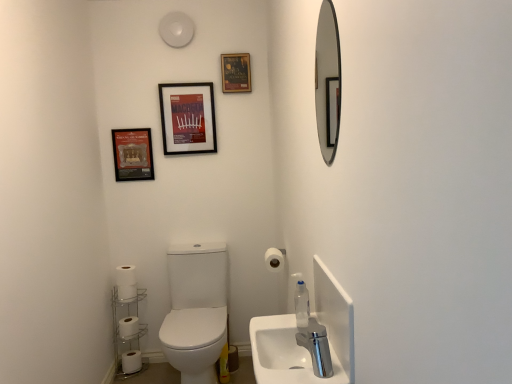
Locate an element on the screen. Image resolution: width=512 pixels, height=384 pixels. white ceramic sink at lower right is located at coordinates (x=285, y=354).

Describe the element at coordinates (188, 118) in the screenshot. I see `matte black picture frame at upper center` at that location.

The image size is (512, 384). What are the coordinates of `matte paper poster at upper center, which appears as the second decorative picture when ordered from the bottom` in the screenshot? It's located at (236, 72).

You are a GUI agent. You are given a task and a screenshot of the screen. Output one action in this format:
    pyautogui.click(x=<x>, y=<y>)
    Task: Click on the white matte toilet paper at lower left, the 3th toilet paper in the right-to-left sequence
    
    Given the screenshot: What is the action you would take?
    pyautogui.click(x=126, y=292)

Measure the distance between silver/metallic toilet paper holder at lower left and camera.

They are 8.21 feet apart.

Where is `white matte toilet paper at lower left, which is the fourth toilet paper in right-to-left order`? white matte toilet paper at lower left, which is the fourth toilet paper in right-to-left order is located at coordinates (128, 327).

From the image's perspective, which toilet paper is the 3rd one above the silver/metallic toilet paper holder at lower left? Please provide its 2D coordinates.

[(274, 260)]

In the scene shown: Considering the relative sizes of silver/metallic toilet paper holder at lower left and white matte toilet paper at lower right, which ranks as the fourth toilet paper in back-to-front order, in the image provided, is silver/metallic toilet paper holder at lower left shorter than white matte toilet paper at lower right, which ranks as the fourth toilet paper in back-to-front order,?

No, silver/metallic toilet paper holder at lower left is not shorter than white matte toilet paper at lower right, which ranks as the fourth toilet paper in back-to-front order.

Does silver/metallic toilet paper holder at lower left have a smaller size compared to white matte toilet paper at lower right, which ranks as the fourth toilet paper in back-to-front order?

No.

Considering their positions, is silver/metallic toilet paper holder at lower left located in front of or behind white matte toilet paper at lower right, which ranks as the fourth toilet paper in back-to-front order?

silver/metallic toilet paper holder at lower left is behind white matte toilet paper at lower right, which ranks as the fourth toilet paper in back-to-front order.

At what (x,y) coordinates should I click in order to perform the action: click on toiletry above the white matte toilet paper at lower left, the third toilet paper from the top (from the image's perspective). Please return your answer as a coordinate pair (x, y). Looking at the image, I should click on (302, 305).

Is clear plastic soap dispenser at lower right looking in the opposite direction of white matte toilet paper at lower left, which is counted as the 1th toilet paper, starting from the left?

No.

Between point (304, 307) and point (131, 333), which one is positioned in front?

Point (304, 307)

How different are the orientations of white matte toilet paper at lower left, placed as the second toilet paper when sorted from bottom to top, and matte black picture frame at upper center in degrees?

They differ by 3.6 degrees in their facing directions.

Is white matte toilet paper at lower left, which is the 2th toilet paper in back-to-front order, positioned in front of matte black picture frame at upper center?

No, the depth of white matte toilet paper at lower left, which is the 2th toilet paper in back-to-front order, is greater than that of matte black picture frame at upper center.

From a real-world perspective, relative to matte black picture frame at upper center, is white matte toilet paper at lower left, placed as the second toilet paper when sorted from bottom to top, vertically above or below?

white matte toilet paper at lower left, placed as the second toilet paper when sorted from bottom to top, is situated lower than matte black picture frame at upper center in the real world.

Is white matte toilet paper at lower left, placed as the second toilet paper when sorted from bottom to top, inside or outside of matte black picture frame at upper center?

white matte toilet paper at lower left, placed as the second toilet paper when sorted from bottom to top, is not enclosed by matte black picture frame at upper center.

From a real-world perspective, who is located lower, white matte toilet paper at lower right, which ranks as the fourth toilet paper in back-to-front order, or white matte toilet paper at lower left, the fourth toilet paper positioned from the top?

white matte toilet paper at lower left, the fourth toilet paper positioned from the top.

Considering the relative positions of white matte toilet paper at lower right, which ranks as the fourth toilet paper in bottom-to-top order, and white matte toilet paper at lower left, positioned as the first toilet paper in bottom-to-top order, in the image provided, is white matte toilet paper at lower right, which ranks as the fourth toilet paper in bottom-to-top order, to the left of white matte toilet paper at lower left, positioned as the first toilet paper in bottom-to-top order, from the viewer's perspective?

No, white matte toilet paper at lower right, which ranks as the fourth toilet paper in bottom-to-top order, is not to the left of white matte toilet paper at lower left, positioned as the first toilet paper in bottom-to-top order.

Is white matte toilet paper at lower right, which ranks as the fourth toilet paper in bottom-to-top order, inside or outside of white matte toilet paper at lower left, which appears as the second toilet paper when viewed from the right?

white matte toilet paper at lower right, which ranks as the fourth toilet paper in bottom-to-top order, is not inside white matte toilet paper at lower left, which appears as the second toilet paper when viewed from the right, it's outside.

Does point (272, 267) come farther from viewer compared to point (131, 370)?

No, it is in front of (131, 370).

The height and width of the screenshot is (384, 512). In order to click on sink located on the right of matte black frame at upper left, the 2th decorative picture viewed from the right in this screenshot , I will do `click(285, 354)`.

Is white ceramic sink at lower right oriented towards matte black frame at upper left, which is counted as the 1th decorative picture, starting from the bottom?

No, white ceramic sink at lower right does not turn towards matte black frame at upper left, which is counted as the 1th decorative picture, starting from the bottom.

Do you think white ceramic sink at lower right is within matte black frame at upper left, the 2th decorative picture viewed from the right, or outside of it?

white ceramic sink at lower right lies outside matte black frame at upper left, the 2th decorative picture viewed from the right.

Between white ceramic sink at lower right and matte black frame at upper left, which is counted as the 1th decorative picture, starting from the bottom, which one appears on the left side from the viewer's perspective?

Positioned to the left is matte black frame at upper left, which is counted as the 1th decorative picture, starting from the bottom.

How much distance is there between white matte toilet paper at lower left, acting as the 4th toilet paper starting from the front, and matte paper poster at upper center, which appears as the second decorative picture when ordered from the bottom?

The distance of white matte toilet paper at lower left, acting as the 4th toilet paper starting from the front, from matte paper poster at upper center, which appears as the second decorative picture when ordered from the bottom, is 5.85 feet.

Is white matte toilet paper at lower left, the first toilet paper positioned from the back, oriented away from matte paper poster at upper center, which ranks as the 1th decorative picture in top-to-bottom order?

That's not correct — white matte toilet paper at lower left, the first toilet paper positioned from the back, is not looking away from matte paper poster at upper center, which ranks as the 1th decorative picture in top-to-bottom order.

From the image's perspective, is white matte toilet paper at lower left, positioned as the first toilet paper in bottom-to-top order, located above or below matte paper poster at upper center, the first decorative picture positioned from the right?

Clearly, from the image's perspective, white matte toilet paper at lower left, positioned as the first toilet paper in bottom-to-top order, is below matte paper poster at upper center, the first decorative picture positioned from the right.

Consider the image. Could matte paper poster at upper center, which ranks as the 1th decorative picture in top-to-bottom order, be considered to be inside clear plastic soap dispenser at lower right?

No, matte paper poster at upper center, which ranks as the 1th decorative picture in top-to-bottom order, is not inside clear plastic soap dispenser at lower right.

In the scene shown: Is clear plastic soap dispenser at lower right oriented towards matte paper poster at upper center, the first decorative picture positioned from the right?

No, clear plastic soap dispenser at lower right is not aimed at matte paper poster at upper center, the first decorative picture positioned from the right.

Is clear plastic soap dispenser at lower right to the left of matte paper poster at upper center, the 2th decorative picture when ordered from left to right, from the viewer's perspective?

In fact, clear plastic soap dispenser at lower right is to the right of matte paper poster at upper center, the 2th decorative picture when ordered from left to right.

This screenshot has height=384, width=512. I want to click on the 3rd toilet paper above the silver/metallic toilet paper holder at lower left (from the image's perspective), so click(274, 260).

From a real-world perspective, starting from the clear plastic soap dispenser at lower right, which toilet paper is the 3rd one below it? Please provide its 2D coordinates.

[(128, 327)]

Looking at the image, which one is located further to white matte toilet paper at lower left, which is the fourth toilet paper in right-to-left order, silver/metallic toilet paper holder at lower left or chrome metallic faucet at lower center?

chrome metallic faucet at lower center.

Considering their positions, is white ceramic sink at lower right positioned further to matte black picture frame at upper center than silver-framed mirror at upper right?

Based on the image, white ceramic sink at lower right appears to be further to matte black picture frame at upper center.

Considering their positions, is chrome metallic faucet at lower center positioned closer to white matte toilet paper at lower left, the second toilet paper from the left, than clear plastic soap dispenser at lower right?

clear plastic soap dispenser at lower right is positioned closer to the anchor white matte toilet paper at lower left, the second toilet paper from the left.

Considering their positions, is matte paper poster at upper center, the 2th decorative picture when ordered from left to right, positioned further to white matte toilet paper at lower left, which is counted as the 1th toilet paper, starting from the left, than clear plastic soap dispenser at lower right?

Based on the image, matte paper poster at upper center, the 2th decorative picture when ordered from left to right, appears to be further to white matte toilet paper at lower left, which is counted as the 1th toilet paper, starting from the left.

From the image, which object appears to be farther from white matte toilet paper at lower right, which is the 1th toilet paper from top to bottom, silver-framed mirror at upper right or matte black picture frame at upper center?

matte black picture frame at upper center.

When comparing their distances from matte paper poster at upper center, the first decorative picture positioned from the right, does white matte toilet paper at lower left, the second toilet paper from the front, or silver/metallic toilet paper holder at lower left seem closer?

Based on the image, white matte toilet paper at lower left, the second toilet paper from the front, appears to be nearer to matte paper poster at upper center, the first decorative picture positioned from the right.

Based on their spatial positions, is white matte toilet paper at lower right, the 1th toilet paper in the front-to-back sequence, or clear plastic soap dispenser at lower right closer to matte black frame at upper left, which appears as the 2th decorative picture when viewed from the top?

white matte toilet paper at lower right, the 1th toilet paper in the front-to-back sequence, is closer to matte black frame at upper left, which appears as the 2th decorative picture when viewed from the top.

Based on the photo, estimate the real-world distances between objects in this image. Which object is closer to silver/metallic toilet paper holder at lower left, matte black frame at upper left, which is counted as the 1th decorative picture, starting from the bottom, or white matte toilet paper at lower right, which ranks as the fourth toilet paper in bottom-to-top order?

matte black frame at upper left, which is counted as the 1th decorative picture, starting from the bottom.

You are a GUI agent. You are given a task and a screenshot of the screen. Output one action in this format:
    pyautogui.click(x=<x>, y=<y>)
    Task: Click on the toiletry between chrome metallic faucet at lower center and white matte toilet paper at lower right, which appears as the first toilet paper when viewed from the right, from front to back
    This screenshot has width=512, height=384.
    Given the screenshot: What is the action you would take?
    pyautogui.click(x=302, y=305)

Locate an element on the screen. The width and height of the screenshot is (512, 384). shelf between clear plastic soap dispenser at lower right and matte black frame at upper left, arranged as the 1th decorative picture when viewed from the left, from front to back is located at coordinates (127, 331).

What are the coordinates of `picture frame located between chrome metallic faucet at lower center and white matte toilet paper at lower left, the third toilet paper when ordered from left to right, in the depth direction` in the screenshot? It's located at (188, 118).

Locate an element on the screen. The height and width of the screenshot is (384, 512). picture frame between matte paper poster at upper center, which ranks as the 1th decorative picture in top-to-bottom order, and white matte toilet paper at lower right, which ranks as the fourth toilet paper in back-to-front order, in the up-down direction is located at coordinates (188, 118).